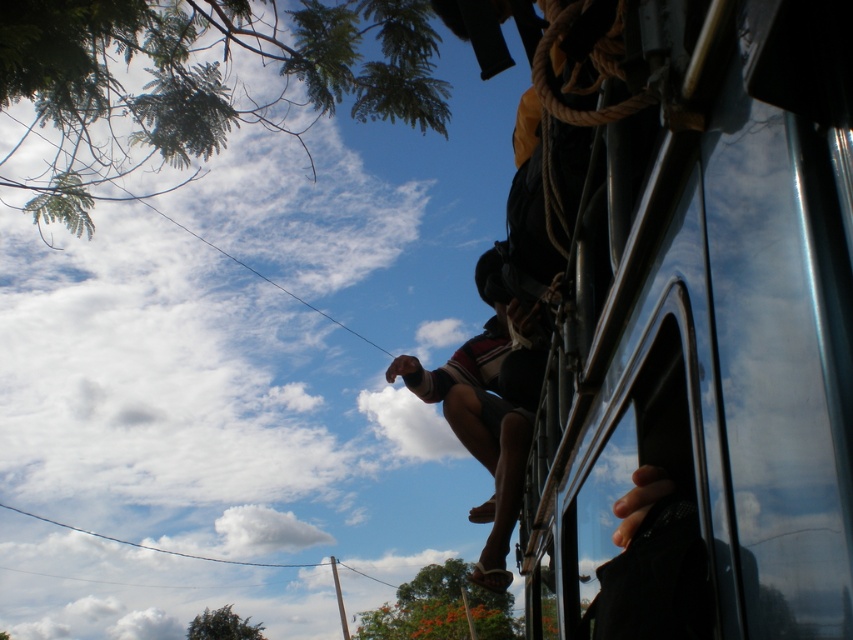
Is point (602, 289) positioned in front of point (459, 410)?

Yes, it is in front of point (459, 410).

Who is positioned more to the left, metallic silver bus at upper right or dark red fabric shorts at center?

Positioned to the left is dark red fabric shorts at center.

Measure the distance between metallic silver bus at upper right and camera.

metallic silver bus at upper right is 23.85 inches away from camera.

Find the location of a particular element. The image size is (853, 640). metallic silver bus at upper right is located at coordinates (711, 316).